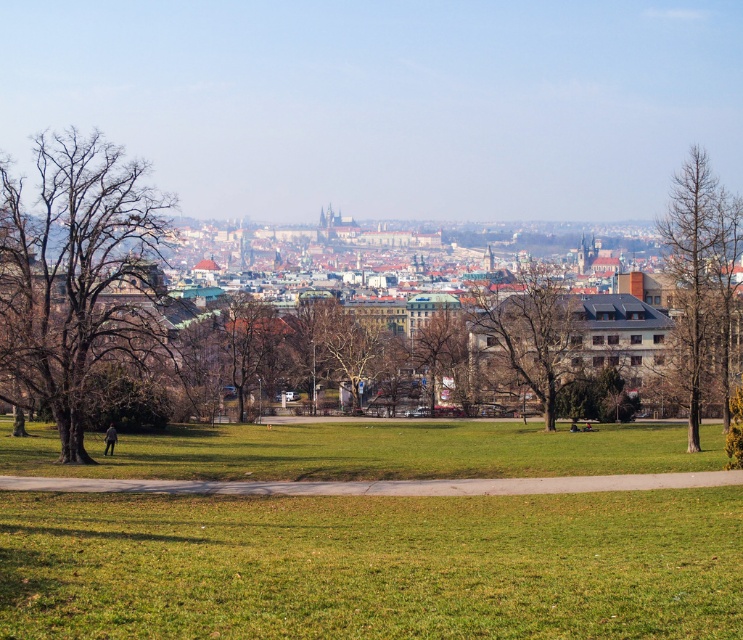
Consider the image. You are a landscape architect designing a new park and want to place a bench between the brown textured tree at center and the brown leafless tree at center. Which tree should the bench be closer to if you want it to be near the larger tree?

The bench should be placed closer to the brown textured tree at center since it is larger than the brown leafless tree at center.

You are standing on the paved pathway in the park and see the bare wood tree at left and the brown textured tree at center. Which tree is closer to your left side?

The bare wood tree at left is closer to your left side because it is positioned to the left of the brown textured tree at center.